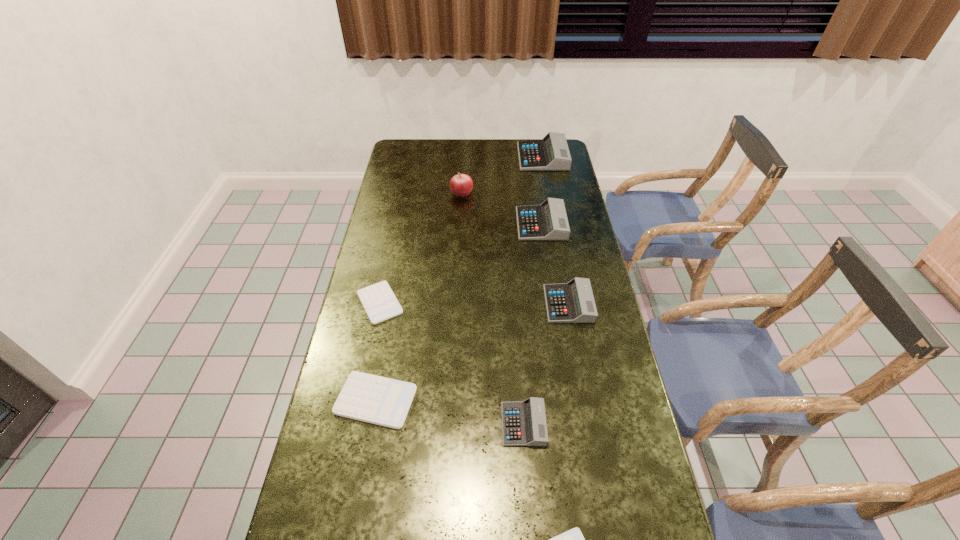
Select which white calculator is the closest to the third farthest object. Please provide its 2D coordinates. Your answer should be formatted as a tuple, i.e. [(x, y)], where the tuple contains the x and y coordinates of a point satisfying the conditions above.

[(378, 300)]

This screenshot has width=960, height=540. I want to click on white calculator that is the second closest to the smallest gray calculator, so (x=365, y=397).